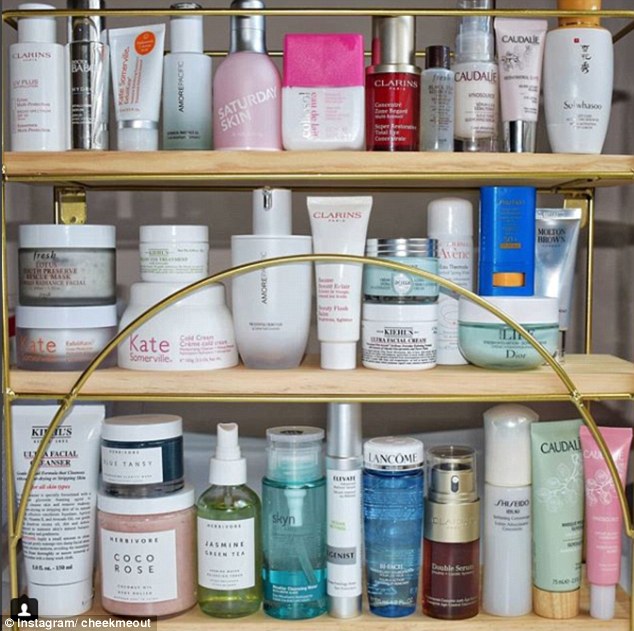
Locate an element on the screen. six more various products on bottom shelf is located at coordinates (299, 520), (345, 529), (456, 517), (507, 529), (544, 529), (610, 539).